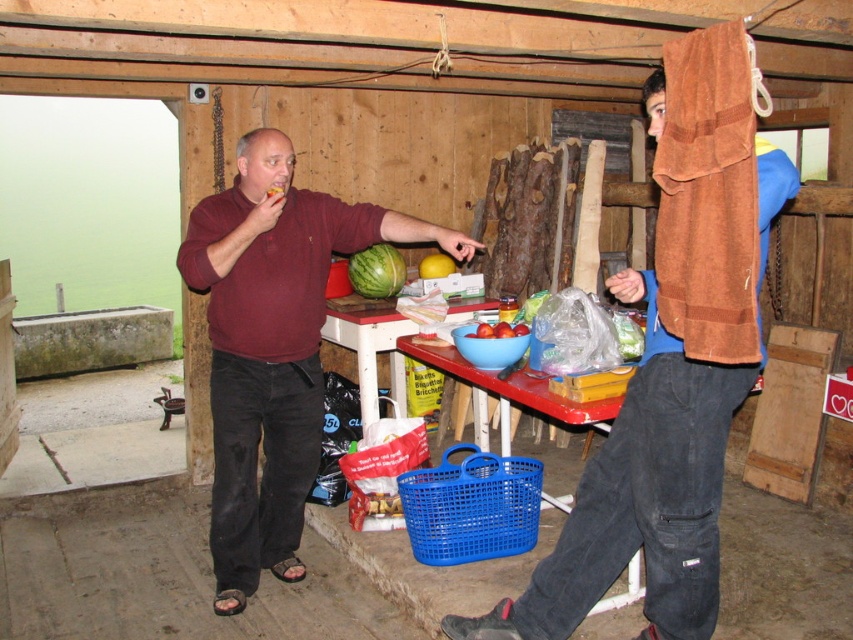
You are standing in the rustic kitchen and want to place a new coat rack at the coordinates where the brown suede jacket at upper right is currently located. Is this possible?

The brown suede jacket at upper right is positioned at point (640, 496), so yes, you can place the coat rack there as it is an existing location in the scene.